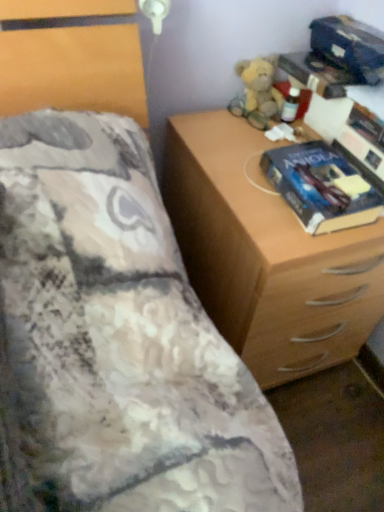
The height and width of the screenshot is (512, 384). I want to click on free space in front of blue glossy paperback book at right, so click(x=308, y=240).